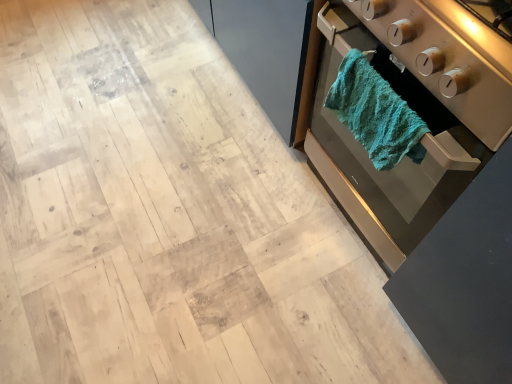
Question: Does teal fabric towel at right have a lesser height compared to teal fabric towel at right?

Choices:
 (A) yes
 (B) no

Answer: (B)

Question: Considering the relative sizes of teal fabric towel at right and teal fabric towel at right in the image provided, is teal fabric towel at right smaller than teal fabric towel at right?

Choices:
 (A) yes
 (B) no

Answer: (B)

Question: From a real-world perspective, is teal fabric towel at right on top of teal fabric towel at right?

Choices:
 (A) no
 (B) yes

Answer: (A)

Question: Is there a large distance between teal fabric towel at right and teal fabric towel at right?

Choices:
 (A) yes
 (B) no

Answer: (B)

Question: Is teal fabric towel at right a part of teal fabric towel at right?

Choices:
 (A) no
 (B) yes

Answer: (A)

Question: Is the surface of teal fabric towel at right in direct contact with teal fabric towel at right?

Choices:
 (A) no
 (B) yes

Answer: (A)

Question: Would you consider teal textured towel at right to be distant from teal fabric towel at right?

Choices:
 (A) yes
 (B) no

Answer: (B)

Question: Is teal textured towel at right smaller than teal fabric towel at right?

Choices:
 (A) yes
 (B) no

Answer: (A)

Question: Could you tell me if teal textured towel at right is facing teal fabric towel at right?

Choices:
 (A) no
 (B) yes

Answer: (A)

Question: Does teal textured towel at right have a greater height compared to teal fabric towel at right?

Choices:
 (A) yes
 (B) no

Answer: (B)

Question: Considering the relative positions of teal textured towel at right and teal fabric towel at right in the image provided, is teal textured towel at right to the left of teal fabric towel at right from the viewer's perspective?

Choices:
 (A) no
 (B) yes

Answer: (B)

Question: Considering the relative sizes of teal textured towel at right and teal fabric towel at right in the image provided, is teal textured towel at right thinner than teal fabric towel at right?

Choices:
 (A) no
 (B) yes

Answer: (B)

Question: From the image's perspective, does teal fabric towel at right appear lower than teal textured towel at right?

Choices:
 (A) no
 (B) yes

Answer: (A)